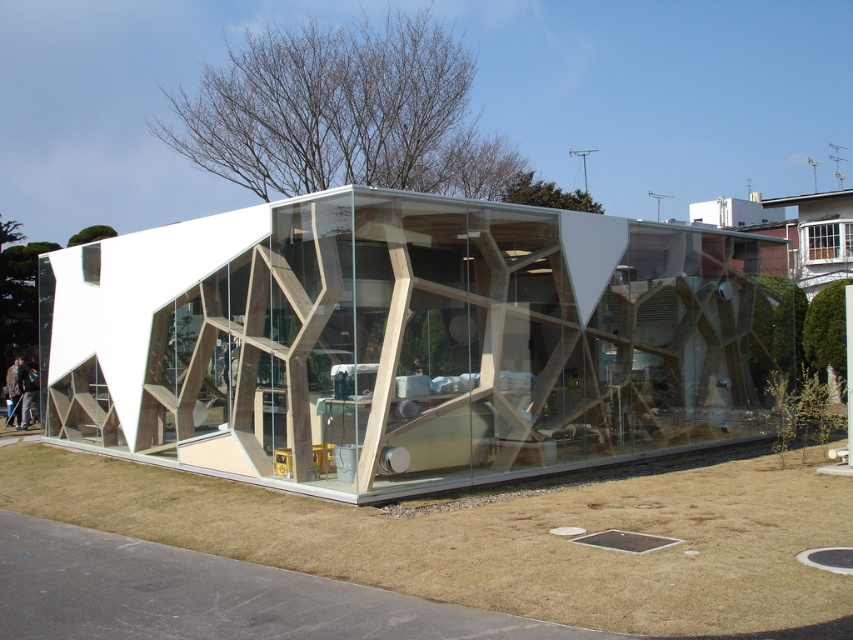
Is the position of transparent wood glass box at center less distant than that of brown dry grass at lower center?

No, transparent wood glass box at center is behind brown dry grass at lower center.

Locate an element on the screen. transparent wood glass box at center is located at coordinates (410, 340).

The height and width of the screenshot is (640, 853). In order to click on transparent wood glass box at center in this screenshot , I will do `click(410, 340)`.